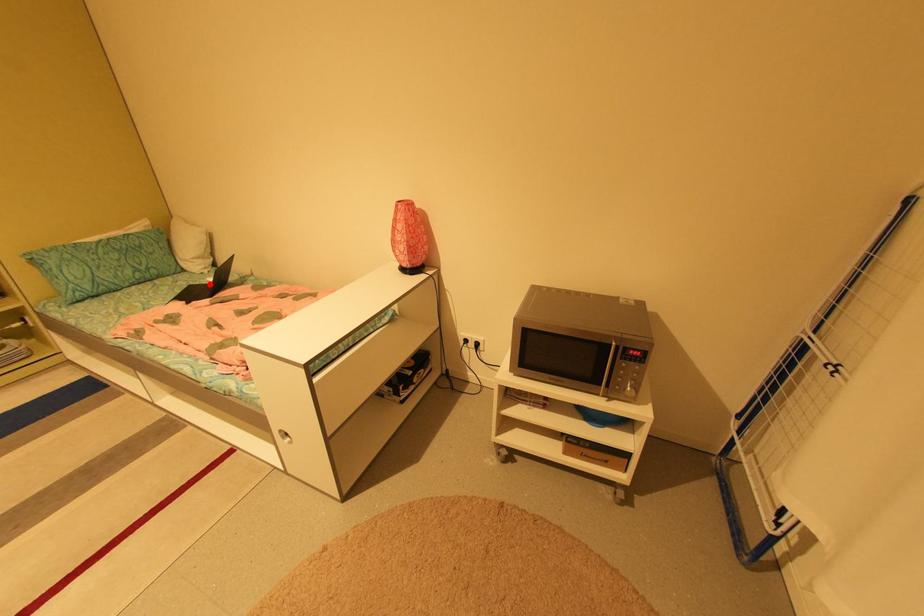
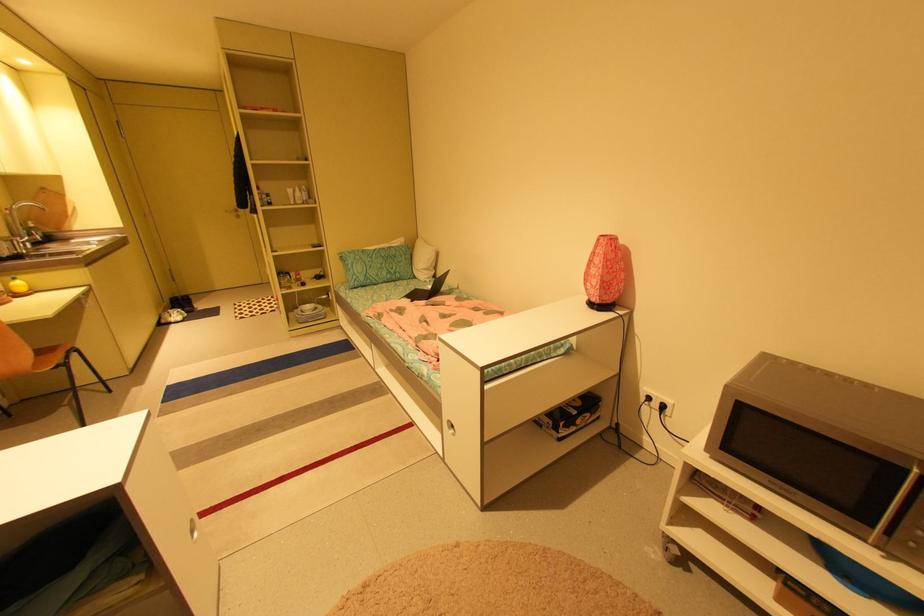
Question: I am providing you with two images of the same scene from different viewpoints. Image1 has a red point marked. In image2, the corresponding 3D location appears at what relative position? Reply with the corresponding letter.

Choices:
 (A) Closer
 (B) Farther

Answer: (B)